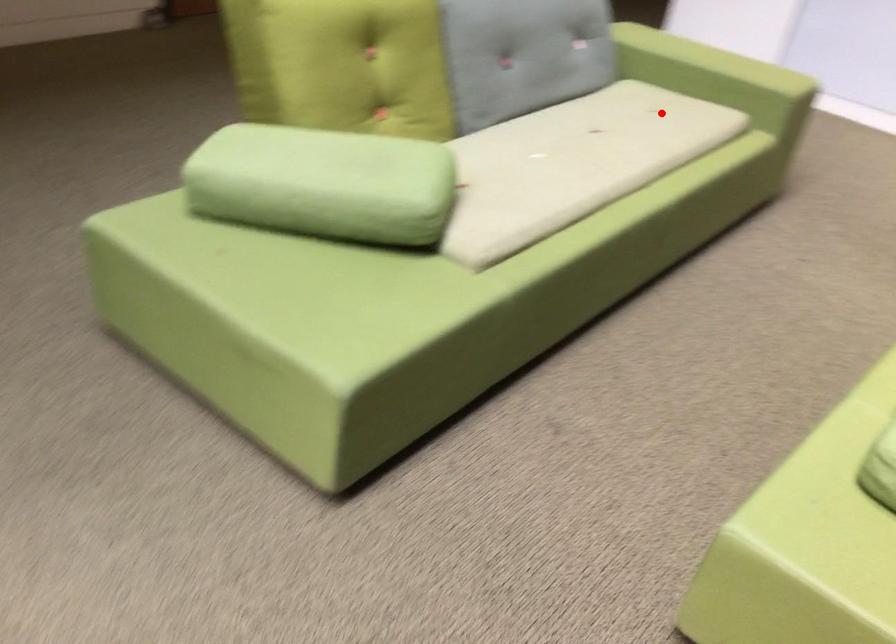
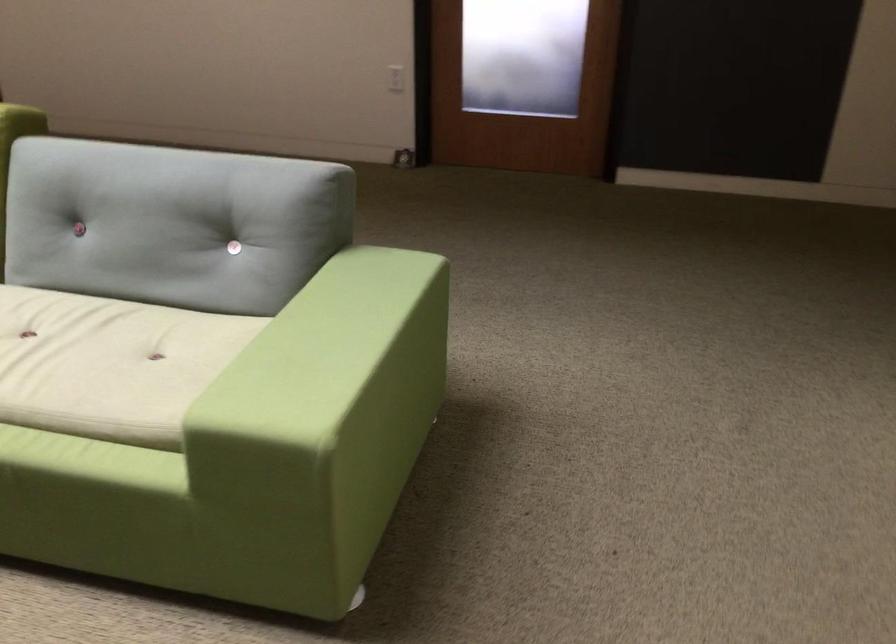
Question: I am providing you with two images of the same scene from different viewpoints. Image1 has a red point marked. In image2, the corresponding 3D location appears at what relative position? Reply with the corresponding letter.

Choices:
 (A) Closer
 (B) Farther

Answer: (A)